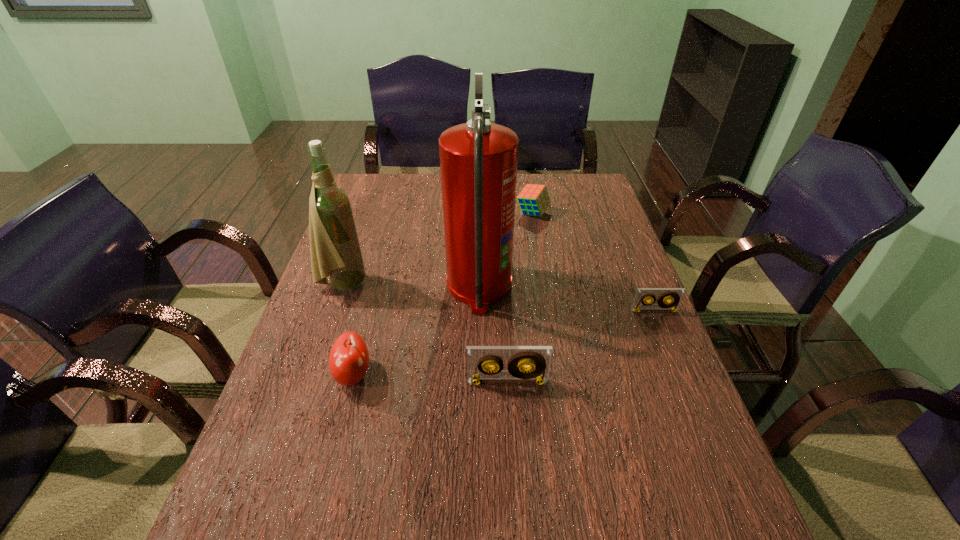
Find the location of a particular element. the taller videotape is located at coordinates (479, 358).

The width and height of the screenshot is (960, 540). Identify the location of the nearer videotape. (479, 358).

The width and height of the screenshot is (960, 540). I want to click on the rightmost object, so click(675, 295).

Where is `the farther videotape`? This screenshot has width=960, height=540. the farther videotape is located at coordinates (675, 295).

The image size is (960, 540). I want to click on cube, so click(x=534, y=199).

The height and width of the screenshot is (540, 960). Find the location of `the tallest object`. the tallest object is located at coordinates (478, 160).

What are the coordinates of `apple` in the screenshot? It's located at (348, 360).

Image resolution: width=960 pixels, height=540 pixels. I want to click on the fifth shortest object, so click(335, 250).

Find the location of a particular element. free space located at the front of the taller videotape with visible reels is located at coordinates (512, 464).

At what (x,y) coordinates should I click in order to perform the action: click on vacant space situated at the front of the shorter videotape with visible reels. Please return your answer as a coordinate pair (x, y). The height and width of the screenshot is (540, 960). Looking at the image, I should click on (667, 342).